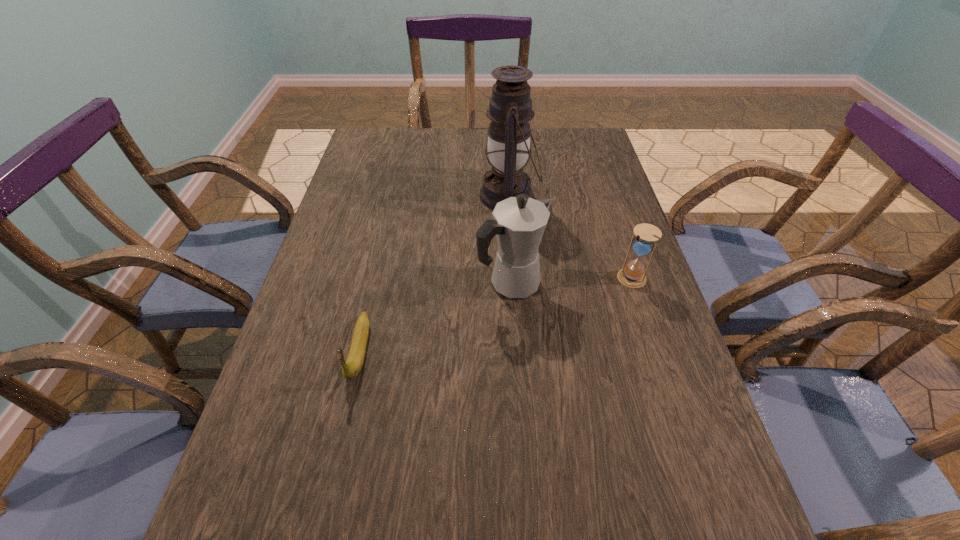
Find the location of a particular element. This screenshot has width=960, height=540. empty location between the coffeepot and the hourglass is located at coordinates (571, 281).

The height and width of the screenshot is (540, 960). In order to click on object that can be found as the closest to the second tallest object in this screenshot , I will do `click(510, 109)`.

Select which object is the closest to the third shortest object. Please provide its 2D coordinates. Your answer should be formatted as a tuple, i.e. [(x, y)], where the tuple contains the x and y coordinates of a point satisfying the conditions above.

[(510, 109)]